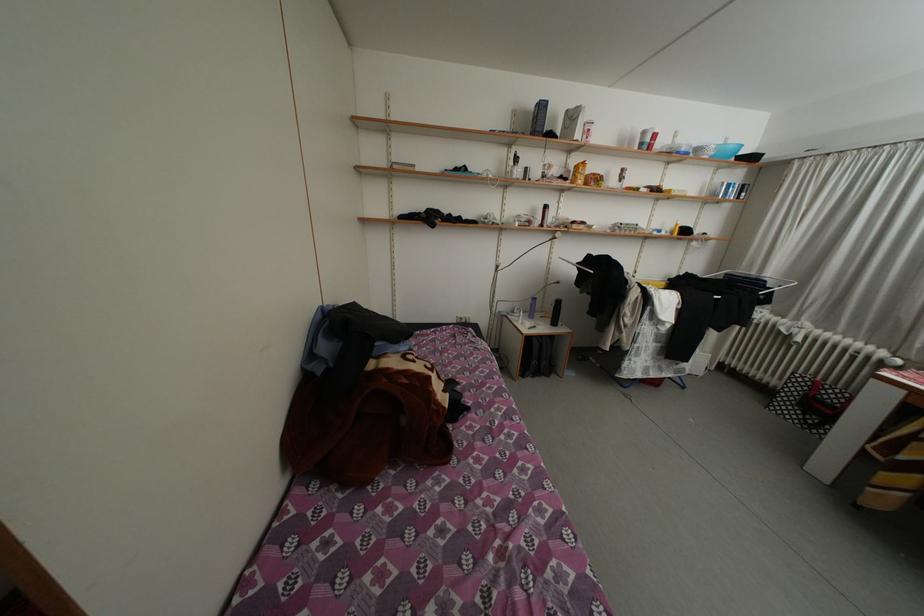
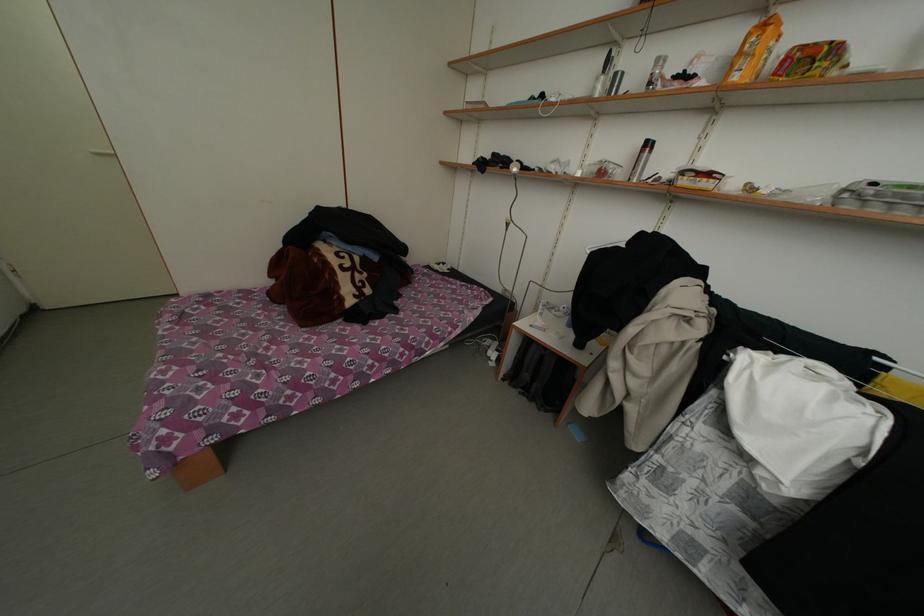
Where in the second image is the point corresponding to the point at 591,168 from the first image?

(774, 29)